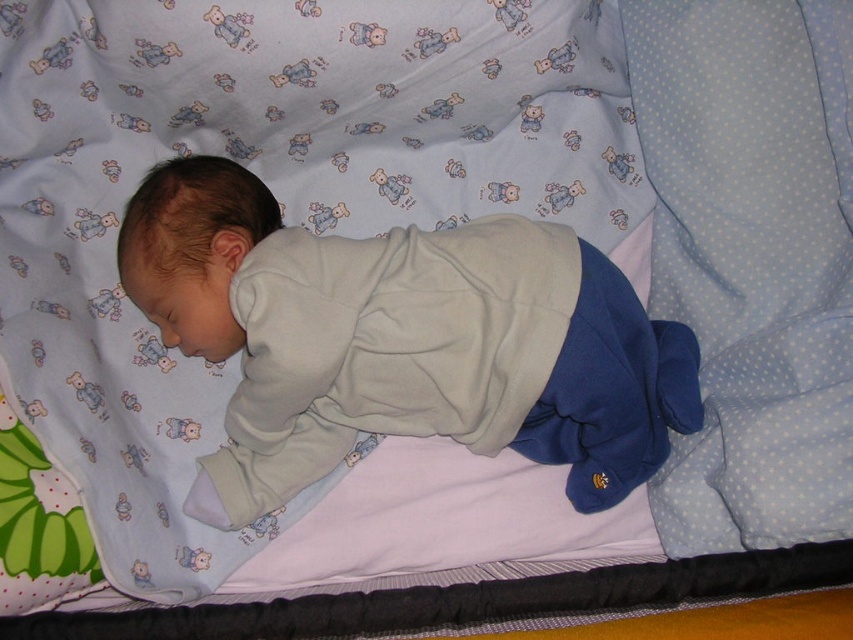
Who is taller, light gray fleece baby at center or light blue dotted pillow at right?

With more height is light blue dotted pillow at right.

Can you confirm if light gray fleece baby at center is positioned to the right of light blue dotted pillow at right?

In fact, light gray fleece baby at center is to the left of light blue dotted pillow at right.

What do you see at coordinates (401, 340) in the screenshot? This screenshot has width=853, height=640. I see `light gray fleece baby at center` at bounding box center [401, 340].

The image size is (853, 640). Find the location of `light gray fleece baby at center`. light gray fleece baby at center is located at coordinates (401, 340).